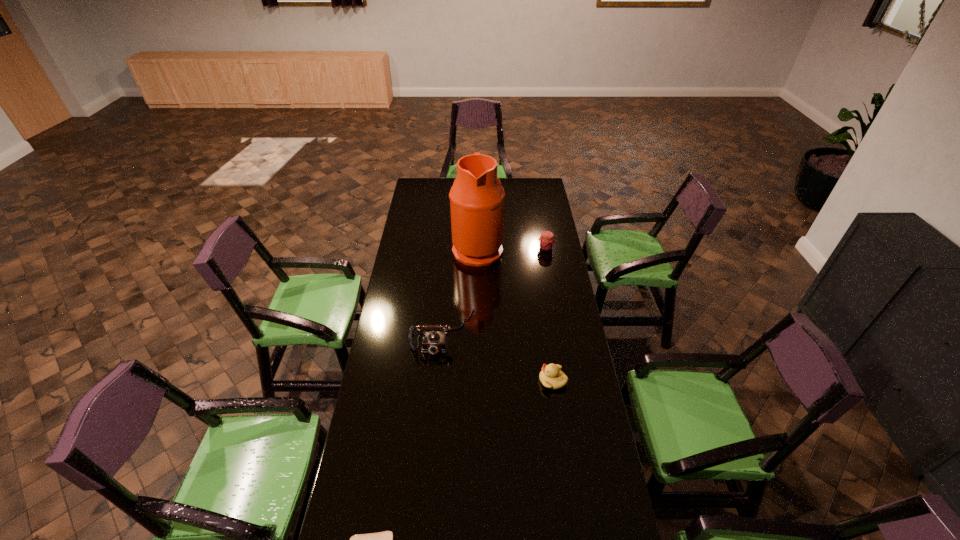
Identify the location of vacant space that satisfies the following two spatial constraints: 1. from the spout of the tallest object; 2. on the left side of the jam. The height and width of the screenshot is (540, 960). [477, 248].

Identify the location of free point that satisfies the following two spatial constraints: 1. from the spout of the tallest object; 2. on the left side of the jam. Image resolution: width=960 pixels, height=540 pixels. (477, 248).